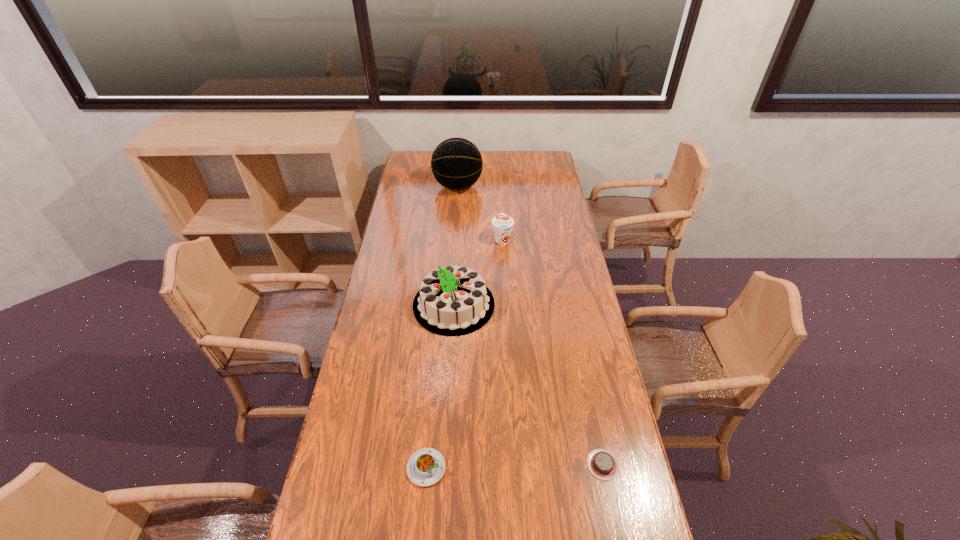
Locate an element on the screen. Image resolution: width=960 pixels, height=540 pixels. free point between the pudding and the fourth nearest object is located at coordinates (465, 354).

Where is `vacant space that's between the third shortest object and the birthday cake`? This screenshot has width=960, height=540. vacant space that's between the third shortest object and the birthday cake is located at coordinates (478, 272).

The image size is (960, 540). Identify the location of vacant area that lies between the yogurt and the tallest object. (480, 213).

Where is `empty location between the birthday cake and the farthest object`? The height and width of the screenshot is (540, 960). empty location between the birthday cake and the farthest object is located at coordinates (456, 246).

Find the location of a particular element. Image resolution: width=960 pixels, height=540 pixels. vacant space that's between the farthest object and the third shortest object is located at coordinates (480, 213).

Image resolution: width=960 pixels, height=540 pixels. What are the coordinates of `free spot between the basketball and the shortest object` in the screenshot? It's located at (530, 326).

Select which object appears as the fourth closest to the second tallest object. Please provide its 2D coordinates. Your answer should be formatted as a tuple, i.e. [(x, y)], where the tuple contains the x and y coordinates of a point satisfying the conditions above.

[(456, 163)]

Select which object is the second closest to the chocolate cake. Please provide its 2D coordinates. Your answer should be formatted as a tuple, i.e. [(x, y)], where the tuple contains the x and y coordinates of a point satisfying the conditions above.

[(454, 300)]

Where is `free spot that satisfies the following two spatial constraints: 1. on the back side of the pudding; 2. on the left side of the fourth shortest object`? The width and height of the screenshot is (960, 540). free spot that satisfies the following two spatial constraints: 1. on the back side of the pudding; 2. on the left side of the fourth shortest object is located at coordinates (441, 305).

Identify the location of vacant area that satisfies the following two spatial constraints: 1. on the front side of the tallest object; 2. on the right side of the chocolate cake. Image resolution: width=960 pixels, height=540 pixels. click(439, 465).